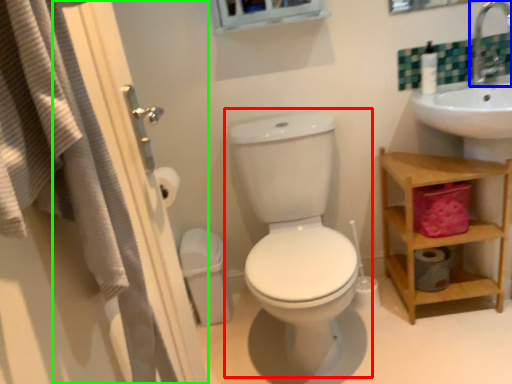
Question: Which object is the farthest from toilet (highlighted by a red box)? Choose among these: faucet (highlighted by a blue box) or screen door (highlighted by a green box).

Choices:
 (A) faucet
 (B) screen door

Answer: (A)